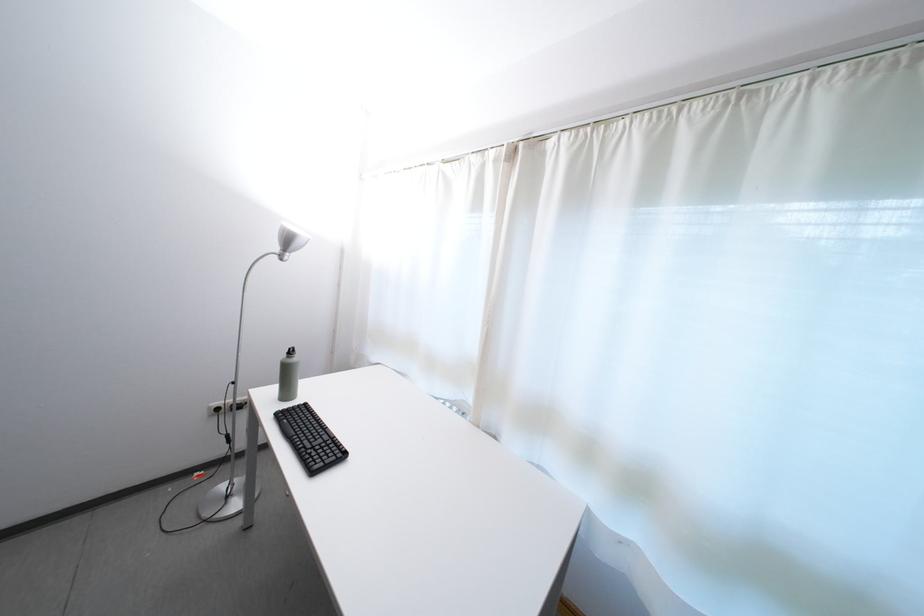
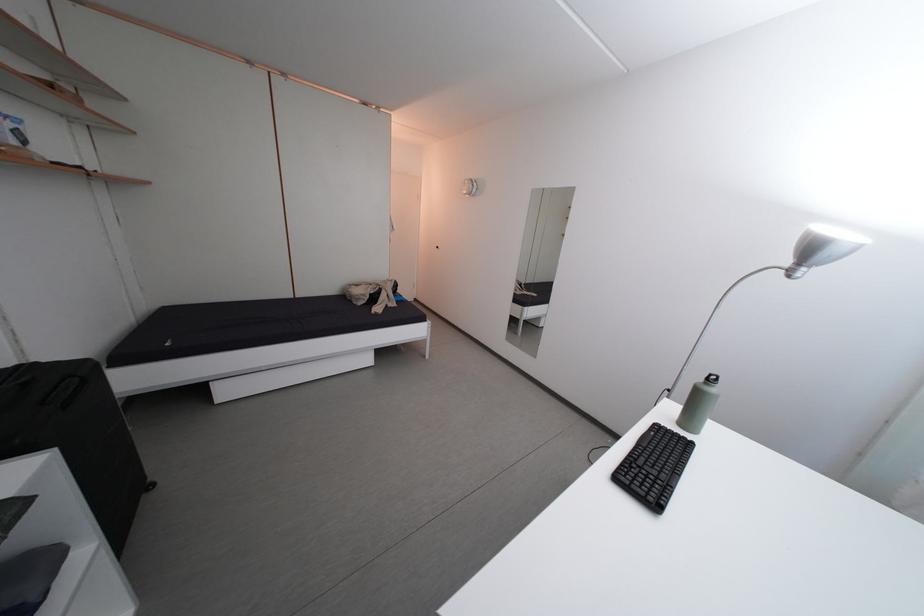
The point at (297, 398) is marked in the first image. Where is the corresponding point in the second image?

(699, 427)